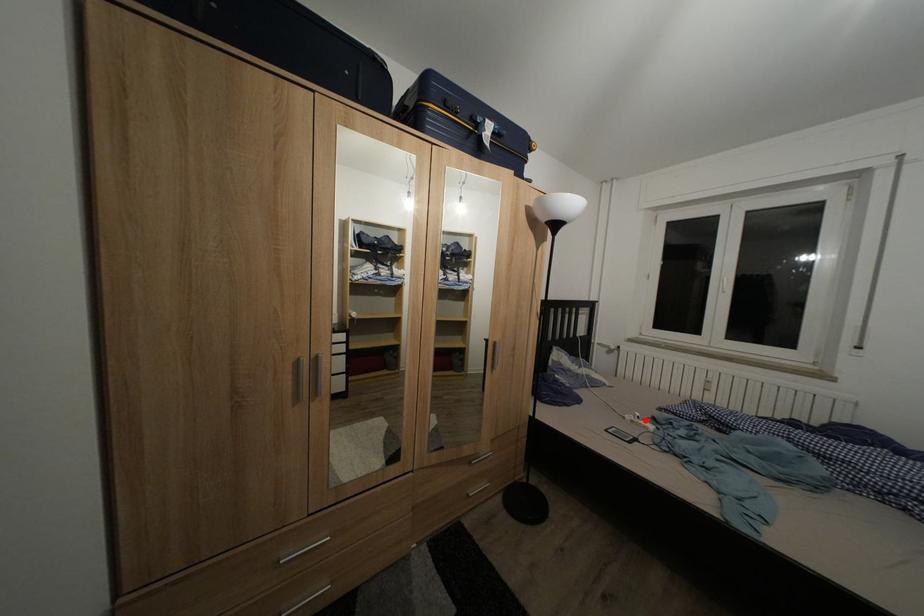
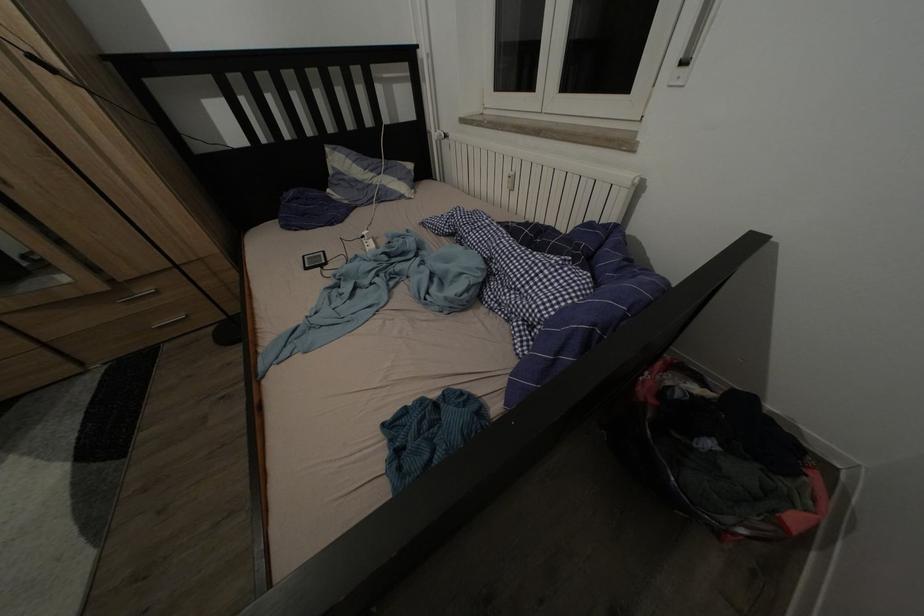
Question: I am providing you with two images of the same scene from different viewpoints. Given a red point in image1, look at the same physical point in image2. Is it:

Choices:
 (A) Closer to the viewpoint
 (B) Farther from the viewpoint

Answer: (B)